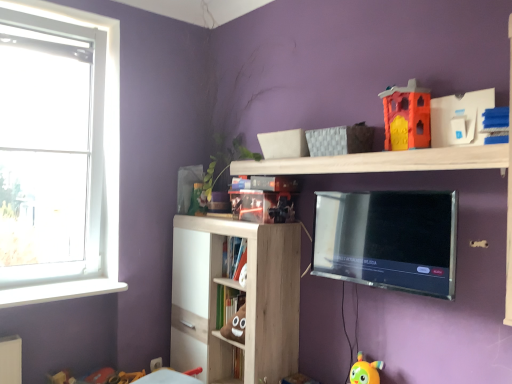
Question: Is glossy plastic bookshelf at upper center, the third book in the bottom-to-top sequence, bigger than white plastic window at left?

Choices:
 (A) no
 (B) yes

Answer: (A)

Question: Is the position of glossy plastic bookshelf at upper center, the third book in the bottom-to-top sequence, less distant than that of white plastic window at left?

Choices:
 (A) no
 (B) yes

Answer: (B)

Question: From a real-world perspective, is glossy plastic bookshelf at upper center, which is the first book in top-to-bottom order, located beneath white plastic window at left?

Choices:
 (A) no
 (B) yes

Answer: (B)

Question: Is there a large distance between glossy plastic bookshelf at upper center, the third book in the bottom-to-top sequence, and white plastic window at left?

Choices:
 (A) yes
 (B) no

Answer: (A)

Question: Is glossy plastic bookshelf at upper center, the third book in the bottom-to-top sequence, wider than white plastic window at left?

Choices:
 (A) no
 (B) yes

Answer: (B)

Question: Is light wood bookshelf at center, the 1th shelf when ordered from bottom to top, in front of or behind glossy plastic bookshelf at upper center, the third book in the bottom-to-top sequence, in the image?

Choices:
 (A) front
 (B) behind

Answer: (A)

Question: Is light wood bookshelf at center, the 1th shelf when ordered from bottom to top, bigger or smaller than glossy plastic bookshelf at upper center, the third book in the bottom-to-top sequence?

Choices:
 (A) small
 (B) big

Answer: (B)

Question: Considering the positions of light wood bookshelf at center, the 1th shelf when ordered from bottom to top, and glossy plastic bookshelf at upper center, which is the first book in top-to-bottom order, in the image, is light wood bookshelf at center, the 1th shelf when ordered from bottom to top, taller or shorter than glossy plastic bookshelf at upper center, which is the first book in top-to-bottom order,?

Choices:
 (A) short
 (B) tall

Answer: (B)

Question: From the image's perspective, is light wood bookshelf at center, the 1th shelf when ordered from bottom to top, positioned above or below glossy plastic bookshelf at upper center, which is the first book in top-to-bottom order?

Choices:
 (A) below
 (B) above

Answer: (A)

Question: Choose the correct answer: Is white glossy window sill at lower left inside wooden shelf at upper center, the 1th shelf when ordered from top to bottom, or outside it?

Choices:
 (A) inside
 (B) outside

Answer: (B)

Question: Considering the positions of white glossy window sill at lower left and wooden shelf at upper center, the 1th shelf when ordered from top to bottom, in the image, is white glossy window sill at lower left bigger or smaller than wooden shelf at upper center, the 1th shelf when ordered from top to bottom,?

Choices:
 (A) big
 (B) small

Answer: (B)

Question: From the image's perspective, is white glossy window sill at lower left above or below wooden shelf at upper center, the 1th shelf when ordered from top to bottom?

Choices:
 (A) above
 (B) below

Answer: (B)

Question: Is point (116, 286) positioned closer to the camera than point (456, 168)?

Choices:
 (A) closer
 (B) farther

Answer: (B)

Question: In the image, is wooden shelf at upper center, placed as the second shelf when sorted from bottom to top, on the left side or the right side of hardcover book at center, the 2th book from the bottom?

Choices:
 (A) left
 (B) right

Answer: (B)

Question: In terms of size, does wooden shelf at upper center, the 1th shelf when ordered from top to bottom, appear bigger or smaller than hardcover book at center, the 2th book from the bottom?

Choices:
 (A) big
 (B) small

Answer: (A)